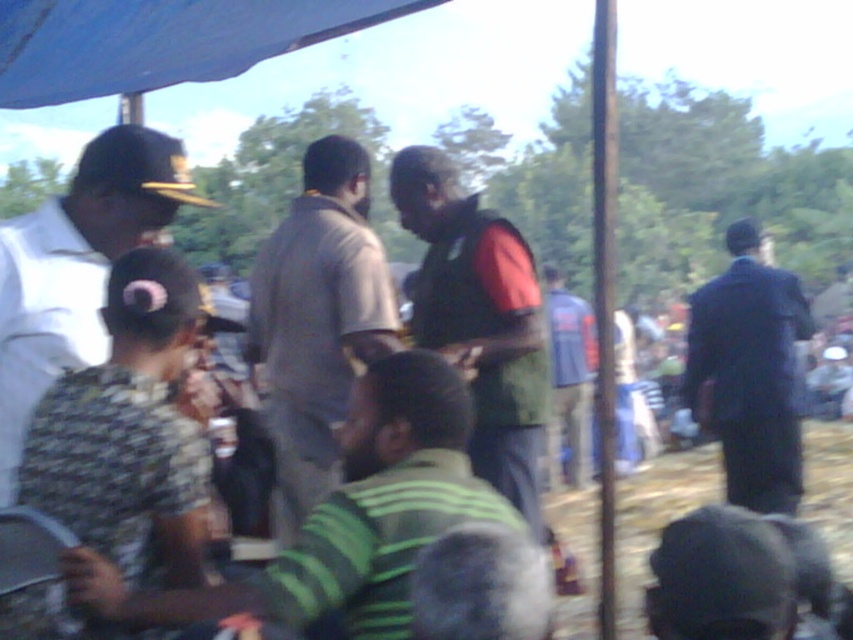
Question: Which object is positioned farthest from the blue fabric shirt at center?

Choices:
 (A) camouflage fabric shirt at lower left
 (B) dark blue suit at right
 (C) green matte vest at center
 (D) gray cotton shirt at center

Answer: (A)

Question: Among these objects, which one is nearest to the camera?

Choices:
 (A) green matte vest at center
 (B) dark blue suit at right
 (C) camouflage shirt at left

Answer: (C)

Question: Can you confirm if camouflage shirt at left is wider than blue fabric shirt at center?

Choices:
 (A) yes
 (B) no

Answer: (B)

Question: Does camouflage fabric shirt at lower left appear over camouflage shirt at left?

Choices:
 (A) yes
 (B) no

Answer: (B)

Question: Is dark blue suit at right further to camera compared to blue fabric shirt at center?

Choices:
 (A) no
 (B) yes

Answer: (A)

Question: Among these points, which one is nearest to the camera?

Choices:
 (A) (100, 253)
 (B) (432, 426)

Answer: (B)